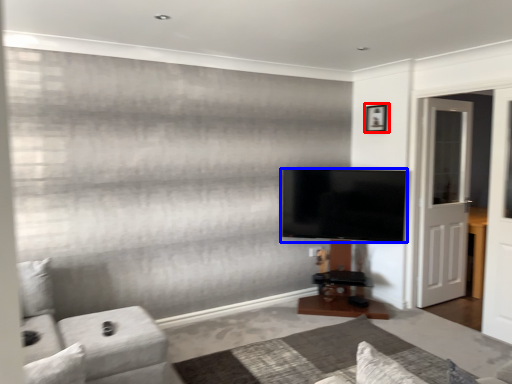
Question: Which object appears farthest to the camera in this image, picture frame (highlighted by a red box) or television (highlighted by a blue box)?

Choices:
 (A) picture frame
 (B) television

Answer: (A)